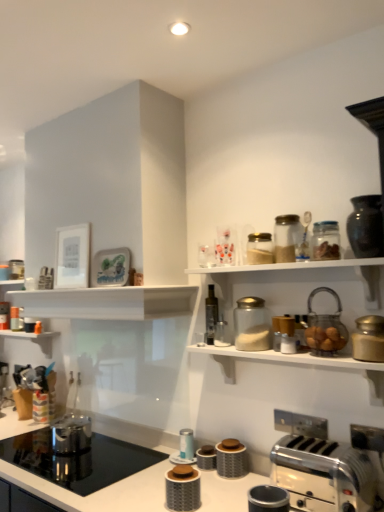
The width and height of the screenshot is (384, 512). What are the coordinates of `metallic silver canister at center, the 10th appliance positioned from the right` in the screenshot? It's located at (186, 444).

I want to click on shiny metallic kettle at lower left, the first appliance from the left, so click(71, 434).

The image size is (384, 512). Describe the element at coordinates (71, 434) in the screenshot. I see `shiny metallic kettle at lower left, acting as the twelfth appliance starting from the right` at that location.

What is the approximate width of translucent glass jar at upper center, marked as the 5th appliance in a right-to-left arrangement?

translucent glass jar at upper center, marked as the 5th appliance in a right-to-left arrangement, is 5.29 inches in width.

Locate an element on the screen. The image size is (384, 512). metallic silver toaster at lower right, which ranks as the 6th appliance in left-to-right order is located at coordinates (268, 499).

This screenshot has width=384, height=512. Find the location of `metallic silver canister at center, the third appliance when ordered from left to right`. metallic silver canister at center, the third appliance when ordered from left to right is located at coordinates (186, 444).

Find the location of a particular element. The width and height of the screenshot is (384, 512). the 6th appliance above the metallic silver canister at lower center, the second appliance when ordered from left to right (from a real-world perspective) is located at coordinates (251, 325).

Can you confirm if transparent glass jar at upper center, which is the 7th appliance in left-to-right order, is shorter than metallic silver canister at lower center, the second appliance when ordered from left to right?

No, transparent glass jar at upper center, which is the 7th appliance in left-to-right order, is not shorter than metallic silver canister at lower center, the second appliance when ordered from left to right.

Consider the image. Is transparent glass jar at upper center, the 6th appliance positioned from the right, closer to the viewer compared to metallic silver canister at lower center, marked as the eleventh appliance in a right-to-left arrangement?

No, transparent glass jar at upper center, the 6th appliance positioned from the right, is further to the viewer.

Is transparent glass jar at upper center, which is the 7th appliance in left-to-right order, far from metallic silver canister at lower center, the second appliance when ordered from left to right?

No, transparent glass jar at upper center, which is the 7th appliance in left-to-right order, is not far away from metallic silver canister at lower center, the second appliance when ordered from left to right.

Considering the points (169, 475) and (220, 472), which point is in front, point (169, 475) or point (220, 472)?

Positioned in front is point (169, 475).

Does metallic silver canister at lower center, the second appliance when ordered from left to right, have a lesser width compared to textured grey canister at center, acting as the 8th appliance starting from the right?

In fact, metallic silver canister at lower center, the second appliance when ordered from left to right, might be wider than textured grey canister at center, acting as the 8th appliance starting from the right.

Who is bigger, metallic silver canister at lower center, marked as the eleventh appliance in a right-to-left arrangement, or textured grey canister at center, which appears as the 5th appliance when viewed from the left?

Bigger between the two is metallic silver canister at lower center, marked as the eleventh appliance in a right-to-left arrangement.

Measure the distance between white glossy shelf at lower left, placed as the 2th shelf when sorted from front to back, and white glossy countertop at lower center.

A distance of 4.07 feet exists between white glossy shelf at lower left, placed as the 2th shelf when sorted from front to back, and white glossy countertop at lower center.

From a real-world perspective, which is physically below, white glossy shelf at lower left, which is the first shelf from back to front, or white glossy countertop at lower center?

In real-world perspective, white glossy countertop at lower center is lower.

Between white glossy shelf at lower left, which appears as the 2th shelf when viewed from the right, and white glossy countertop at lower center, which one has larger size?

With larger size is white glossy countertop at lower center.

Is white glossy shelf at lower left, which is the first shelf from back to front, next to white glossy countertop at lower center and touching it?

No, white glossy shelf at lower left, which is the first shelf from back to front, is not touching white glossy countertop at lower center.

There is a white glossy countertop at lower center. Find the location of `the 5th appliance above it (from the image's perspective)`. the 5th appliance above it (from the image's perspective) is located at coordinates (183, 488).

Can you tell me how much white glossy countertop at lower center and metallic silver canister at lower center, the second appliance when ordered from left to right, differ in facing direction?

white glossy countertop at lower center and metallic silver canister at lower center, the second appliance when ordered from left to right, are facing 0.912 degrees away from each other.

Does white glossy countertop at lower center have a larger size compared to metallic silver canister at lower center, the second appliance when ordered from left to right?

Indeed, white glossy countertop at lower center has a larger size compared to metallic silver canister at lower center, the second appliance when ordered from left to right.

Is white glossy countertop at lower center aimed at metallic silver canister at lower center, marked as the eleventh appliance in a right-to-left arrangement?

No.

Where is `the 5th appliance behind the metallic silver canister at lower center, marked as the eleventh appliance in a right-to-left arrangement`? the 5th appliance behind the metallic silver canister at lower center, marked as the eleventh appliance in a right-to-left arrangement is located at coordinates (232, 458).

Is textured grey canister at center, acting as the 8th appliance starting from the right, oriented towards metallic silver canister at lower center, the second appliance when ordered from left to right?

Yes, textured grey canister at center, acting as the 8th appliance starting from the right, faces towards metallic silver canister at lower center, the second appliance when ordered from left to right.

Would you say metallic silver canister at lower center, the second appliance when ordered from left to right, is part of textured grey canister at center, which appears as the 5th appliance when viewed from the left,'s contents?

No, metallic silver canister at lower center, the second appliance when ordered from left to right, is located outside of textured grey canister at center, which appears as the 5th appliance when viewed from the left.

Considering the positions of point (293, 253) and point (299, 344), is point (293, 253) closer or farther from the camera than point (299, 344)?

Point (293, 253) appears to be farther away from the viewer than point (299, 344).

Consider the image. Is translucent glass jar at upper right, marked as the 2th glass jar in a right-to-left arrangement, aimed at metallic silver toaster at lower right, which is the 9th appliance from left to right?

No, translucent glass jar at upper right, marked as the 2th glass jar in a right-to-left arrangement, is not turned towards metallic silver toaster at lower right, which is the 9th appliance from left to right.

Does translucent glass jar at upper right, which is the 1th glass jar from back to front, have a larger size compared to metallic silver toaster at lower right, positioned as the 4th appliance in right-to-left order?

Yes, translucent glass jar at upper right, which is the 1th glass jar from back to front, is bigger than metallic silver toaster at lower right, positioned as the 4th appliance in right-to-left order.

In order to click on the 2nd appliance positioned below the silver metallic toaster at lower right (from the image's perspective) in this screenshot , I will do `click(232, 458)`.

Between point (228, 462) and point (285, 479), which one is positioned in front?

Point (285, 479)

Between textured grey canister at center, acting as the 8th appliance starting from the right, and silver metallic toaster at lower right, which one has larger width?

silver metallic toaster at lower right.

At what (x,y) coordinates should I click in order to perform the action: click on the 4th appliance below when counting from the transparent glass jar at upper center, which is the 7th appliance in left-to-right order (from the image's perspective). Please return your answer as a coordinate pair (x, y). Looking at the image, I should click on (183, 488).

Where is `the 5th appliance in front when counting from the textured grey canister at center, which appears as the 5th appliance when viewed from the left`? the 5th appliance in front when counting from the textured grey canister at center, which appears as the 5th appliance when viewed from the left is located at coordinates (183, 488).

Which object lies further to the anchor point metallic silver toaster at lower right, which ranks as the seventh appliance in right-to-left order, textured grey canister at center, which appears as the 5th appliance when viewed from the left, or translucent glass jar at upper center, marked as the 5th appliance in a right-to-left arrangement?

The object further to metallic silver toaster at lower right, which ranks as the seventh appliance in right-to-left order, is translucent glass jar at upper center, marked as the 5th appliance in a right-to-left arrangement.

Based on their spatial positions, is shiny metallic kettle at lower left, acting as the twelfth appliance starting from the right, or silver metallic toaster at lower right closer to metallic silver canister at center, the third appliance when ordered from left to right?

Based on the image, shiny metallic kettle at lower left, acting as the twelfth appliance starting from the right, appears to be nearer to metallic silver canister at center, the third appliance when ordered from left to right.

Based on the photo, looking at the image, which one is located further to metallic silver toaster at lower right, positioned as the 4th appliance in right-to-left order, gold metallic canister at upper right, the eleventh appliance positioned from the left, or white glossy countertop at lower center?

The object further to metallic silver toaster at lower right, positioned as the 4th appliance in right-to-left order, is white glossy countertop at lower center.

Which object lies nearer to the anchor point gold metallic canister at upper right, which is the 2th appliance from right to left, white glossy shelf at upper center, positioned as the second shelf in left-to-right order, or metallic silver canister at lower center, the second appliance when ordered from left to right?

metallic silver canister at lower center, the second appliance when ordered from left to right, is positioned closer to the anchor gold metallic canister at upper right, which is the 2th appliance from right to left.

Looking at the image, which one is located further to white glossy shelf at upper center, positioned as the second shelf in left-to-right order, textured grey canister at center, which appears as the 5th appliance when viewed from the left, or metallic silver canister at center, the 10th appliance positioned from the right?

Based on the image, textured grey canister at center, which appears as the 5th appliance when viewed from the left, appears to be further to white glossy shelf at upper center, positioned as the second shelf in left-to-right order.

In the scene shown: Which object lies further to the anchor point translucent glass jar at upper center, marked as the 5th appliance in a right-to-left arrangement, metallic silver toaster at lower right, which ranks as the 6th appliance in left-to-right order, or white glossy countertop at lower center?

white glossy countertop at lower center is positioned further to the anchor translucent glass jar at upper center, marked as the 5th appliance in a right-to-left arrangement.

Looking at the image, which one is located closer to white glossy countertop at lower center, gold metallic canister at upper right, which is the 2th appliance from right to left, or textured grey canister at center, which appears as the 5th appliance when viewed from the left?

textured grey canister at center, which appears as the 5th appliance when viewed from the left.

Considering their positions, is translucent glass jar at upper center, marked as the 5th appliance in a right-to-left arrangement, positioned further to transparent glass jar at upper center, the 6th appliance positioned from the right, than white glossy shelf at upper center, acting as the 1th shelf starting from the front?

white glossy shelf at upper center, acting as the 1th shelf starting from the front, is further to transparent glass jar at upper center, the 6th appliance positioned from the right.

At what (x,y) coordinates should I click in order to perform the action: click on shelf situated between white glossy shelf at lower left, which ranks as the first shelf in left-to-right order, and transparent glass jar at upper center, the 6th appliance positioned from the right, from left to right. Please return your answer as a coordinate pair (x, y). Image resolution: width=384 pixels, height=512 pixels. Looking at the image, I should click on (107, 302).

This screenshot has width=384, height=512. Identify the location of bottle between translucent glass jar at upper right, marked as the 1th glass jar in a left-to-right arrangement, and metallic silver canister at center, marked as the 9th appliance in a right-to-left arrangement, in the vertical direction. (211, 315).

I want to click on bottle located between white glossy shelf at upper center, positioned as the first shelf in right-to-left order, and textured grey canister at center, acting as the 8th appliance starting from the right, in the left-right direction, so click(211, 315).

I want to click on glass jar that lies between translucent glass jar at upper right, marked as the 1th glass jar in a left-to-right arrangement, and gold metallic canister at upper right, which is the 2th appliance from right to left, from top to bottom, so click(326, 241).